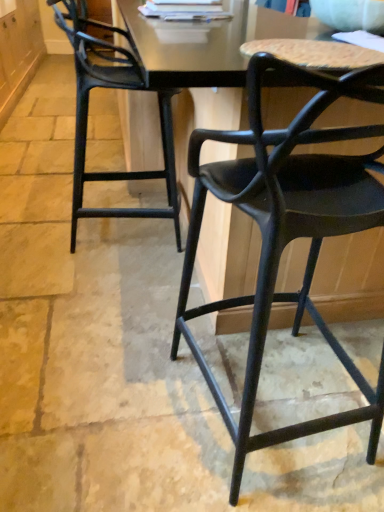
The height and width of the screenshot is (512, 384). Find the location of `matte black chair at left, the 2th chair positioned from the front`. matte black chair at left, the 2th chair positioned from the front is located at coordinates (87, 113).

The width and height of the screenshot is (384, 512). Describe the element at coordinates (87, 113) in the screenshot. I see `matte black chair at left, which is the 1th chair from back to front` at that location.

Find the location of a particular element. matte black chair at center, the 2th chair in the left-to-right sequence is located at coordinates (287, 232).

What do you see at coordinates (287, 232) in the screenshot? This screenshot has width=384, height=512. I see `matte black chair at center, which appears as the first chair when viewed from the right` at bounding box center [287, 232].

This screenshot has width=384, height=512. I want to click on matte black chair at left, the 2th chair positioned from the front, so click(x=87, y=113).

Considering the positions of objects matte black chair at left, which is the 1th chair from back to front, and matte black chair at center, the 2th chair in the left-to-right sequence, in the image provided, who is more to the left, matte black chair at left, which is the 1th chair from back to front, or matte black chair at center, the 2th chair in the left-to-right sequence,?

Positioned to the left is matte black chair at left, which is the 1th chair from back to front.

In the scene shown: In the image, is matte black chair at left, arranged as the second chair when viewed from the right, positioned in front of or behind matte black chair at center, marked as the first chair in a front-to-back arrangement?

matte black chair at left, arranged as the second chair when viewed from the right, is behind matte black chair at center, marked as the first chair in a front-to-back arrangement.

Which is in front, point (140, 173) or point (225, 198)?

The point (225, 198) is closer.

Looking at this image, from the image's perspective, is matte black chair at left, arranged as the second chair when viewed from the right, located beneath matte black chair at center, marked as the first chair in a front-to-back arrangement?

No.

From a real-world perspective, who is located lower, matte black chair at left, arranged as the second chair when viewed from the right, or matte black chair at center, which appears as the first chair when viewed from the right?

matte black chair at left, arranged as the second chair when viewed from the right, from a real-world perspective.

From the picture: Considering the relative sizes of matte black chair at left, arranged as the second chair when viewed from the right, and matte black chair at center, marked as the first chair in a front-to-back arrangement, in the image provided, is matte black chair at left, arranged as the second chair when viewed from the right, wider than matte black chair at center, marked as the first chair in a front-to-back arrangement,?

No.

From their relative heights in the image, would you say matte black chair at left, which is the 1th chair from back to front, is taller or shorter than matte black chair at center, the 2th chair in the left-to-right sequence?

In the image, matte black chair at left, which is the 1th chair from back to front, appears to be shorter than matte black chair at center, the 2th chair in the left-to-right sequence.

Considering the sizes of matte black chair at left, acting as the first chair starting from the left, and matte black chair at center, which appears as the first chair when viewed from the right, in the image, is matte black chair at left, acting as the first chair starting from the left, bigger or smaller than matte black chair at center, which appears as the first chair when viewed from the right,?

Considering their sizes, matte black chair at left, acting as the first chair starting from the left, takes up less space than matte black chair at center, which appears as the first chair when viewed from the right.

Consider the image. Is matte black chair at center, the 2th chair in the left-to-right sequence, surrounded by matte black chair at left, the 2th chair positioned from the front?

No, matte black chair at left, the 2th chair positioned from the front, does not contain matte black chair at center, the 2th chair in the left-to-right sequence.

Is matte black chair at left, which is the 1th chair from back to front, beside matte black chair at center, marked as the first chair in a front-to-back arrangement?

No, matte black chair at left, which is the 1th chair from back to front, is not touching matte black chair at center, marked as the first chair in a front-to-back arrangement.

Could you tell me if matte black chair at left, which is the 1th chair from back to front, is turned towards matte black chair at center, the 2th chair in the left-to-right sequence?

No, matte black chair at left, which is the 1th chair from back to front, is not turned towards matte black chair at center, the 2th chair in the left-to-right sequence.

Measure the distance between matte black chair at left, which is the 1th chair from back to front, and matte black chair at center, which appears as the first chair when viewed from the right.

A distance of 22.96 inches exists between matte black chair at left, which is the 1th chair from back to front, and matte black chair at center, which appears as the first chair when viewed from the right.

Locate an element on the screen. The width and height of the screenshot is (384, 512). chair directly beneath the matte black chair at center, which appears as the first chair when viewed from the right (from a real-world perspective) is located at coordinates (87, 113).

Can you confirm if matte black chair at center, the 2th chair in the left-to-right sequence, is positioned to the left of matte black chair at left, acting as the first chair starting from the left?

In fact, matte black chair at center, the 2th chair in the left-to-right sequence, is to the right of matte black chair at left, acting as the first chair starting from the left.

Looking at this image, which object is more forward, matte black chair at center, marked as the first chair in a front-to-back arrangement, or matte black chair at left, the 2th chair positioned from the front?

matte black chair at center, marked as the first chair in a front-to-back arrangement.

Is point (325, 203) positioned after point (156, 174)?

No, (325, 203) is closer to viewer.

From the image's perspective, is matte black chair at center, the 2th chair in the left-to-right sequence, under matte black chair at left, acting as the first chair starting from the left?

Yes.

From a real-world perspective, is matte black chair at center, which is counted as the second chair, starting from the back, positioned above or below matte black chair at left, which is the 1th chair from back to front?

In terms of real-world spatial position, matte black chair at center, which is counted as the second chair, starting from the back, is above matte black chair at left, which is the 1th chair from back to front.

Looking at their sizes, would you say matte black chair at center, the 2th chair in the left-to-right sequence, is wider or thinner than matte black chair at left, the 2th chair positioned from the front?

matte black chair at center, the 2th chair in the left-to-right sequence, is wider than matte black chair at left, the 2th chair positioned from the front.

Is matte black chair at center, marked as the first chair in a front-to-back arrangement, taller than matte black chair at left, acting as the first chair starting from the left?

Correct, matte black chair at center, marked as the first chair in a front-to-back arrangement, is much taller as matte black chair at left, acting as the first chair starting from the left.

Looking at the image, does matte black chair at center, marked as the first chair in a front-to-back arrangement, seem bigger or smaller compared to matte black chair at left, which is the 1th chair from back to front?

Considering their sizes, matte black chair at center, marked as the first chair in a front-to-back arrangement, takes up more space than matte black chair at left, which is the 1th chair from back to front.

Is matte black chair at left, which is the 1th chair from back to front, surrounded by matte black chair at center, marked as the first chair in a front-to-back arrangement?

No, matte black chair at left, which is the 1th chair from back to front, is not a part of matte black chair at center, marked as the first chair in a front-to-back arrangement.

Is there a large distance between matte black chair at center, marked as the first chair in a front-to-back arrangement, and matte black chair at left, which is the 1th chair from back to front?

They are positioned close to each other.

Is matte black chair at center, marked as the first chair in a front-to-back arrangement, looking in the opposite direction of matte black chair at left, acting as the first chair starting from the left?

matte black chair at center, marked as the first chair in a front-to-back arrangement, does not have its back to matte black chair at left, acting as the first chair starting from the left.

Measure the distance between matte black chair at center, which is counted as the second chair, starting from the back, and matte black chair at left, the 2th chair positioned from the front.

matte black chair at center, which is counted as the second chair, starting from the back, is 22.96 inches away from matte black chair at left, the 2th chair positioned from the front.

Where is `chair above the matte black chair at left, the 2th chair positioned from the front (from a real-world perspective)`? chair above the matte black chair at left, the 2th chair positioned from the front (from a real-world perspective) is located at coordinates (287, 232).

At what (x,y) coordinates should I click in order to perform the action: click on chair below the matte black chair at center, marked as the first chair in a front-to-back arrangement (from a real-world perspective). Please return your answer as a coordinate pair (x, y). The height and width of the screenshot is (512, 384). Looking at the image, I should click on (87, 113).

Find the location of a particular element. Image resolution: width=384 pixels, height=512 pixels. chair above the matte black chair at left, arranged as the second chair when viewed from the right (from a real-world perspective) is located at coordinates (287, 232).